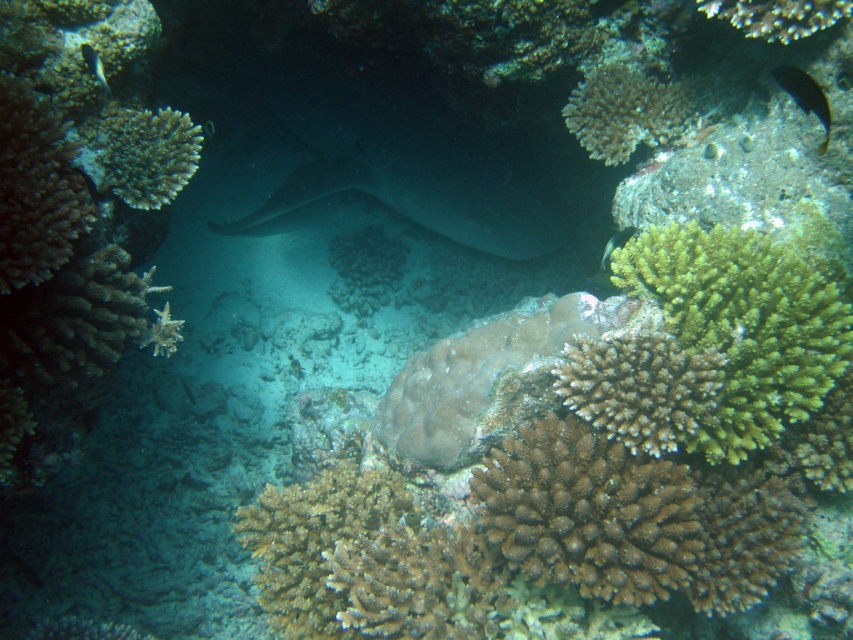
Question: Among these objects, which one is nearest to the camera?

Choices:
 (A) white coral at upper right
 (B) smooth gray stingray at center

Answer: (A)

Question: Can you confirm if smooth gray stingray at center is positioned below green matte fish at upper right?

Choices:
 (A) no
 (B) yes

Answer: (A)

Question: Which is farther from the green textured coral at upper left?

Choices:
 (A) brown coral at center
 (B) white coral at upper right
 (C) green frondose coral at center

Answer: (B)

Question: Is brown coral at center to the left of green textured coral at upper right from the viewer's perspective?

Choices:
 (A) no
 (B) yes

Answer: (B)

Question: Which point is closer to the camera?

Choices:
 (A) (741, 3)
 (B) (755, 240)
 (C) (788, 276)

Answer: (C)

Question: Observing the image, what is the correct spatial positioning of brown coral at center in reference to smooth gray stingray at center?

Choices:
 (A) right
 (B) left

Answer: (A)